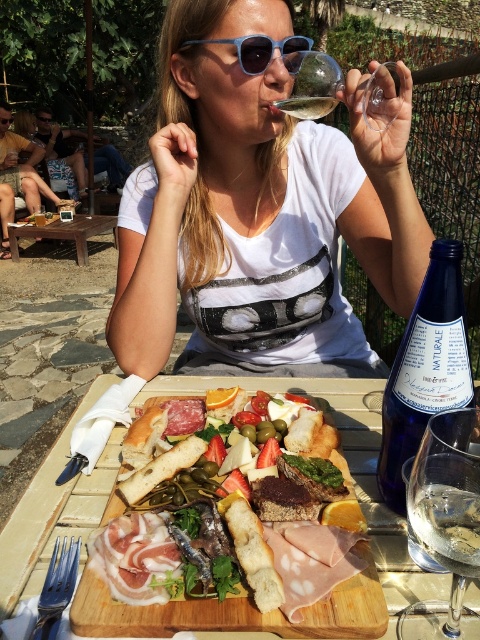
Question: From the image, what is the correct spatial relationship of white matte t-shirt at center in relation to transparent glass at upper center?

Choices:
 (A) left
 (B) right

Answer: (A)

Question: Which point is closer to the camera?

Choices:
 (A) blue glass bottle at center-right
 (B) wooden table at lower left

Answer: (A)

Question: Which of the following is the farthest from the observer?

Choices:
 (A) clear glass wine at lower right
 (B) clear glass wine at upper center

Answer: (B)

Question: Is white matte t-shirt at center thinner than blue glass bottle at center-right?

Choices:
 (A) yes
 (B) no

Answer: (B)

Question: Based on their relative distances, which object is nearer to the blue glass bottle at center-right?

Choices:
 (A) wooden table at lower left
 (B) transparent glass wine glass at lower right
 (C) white matte t-shirt at center
 (D) transparent glass at upper center

Answer: (B)

Question: Can you confirm if white matte t-shirt at center is smaller than blue glass bottle at center-right?

Choices:
 (A) yes
 (B) no

Answer: (B)